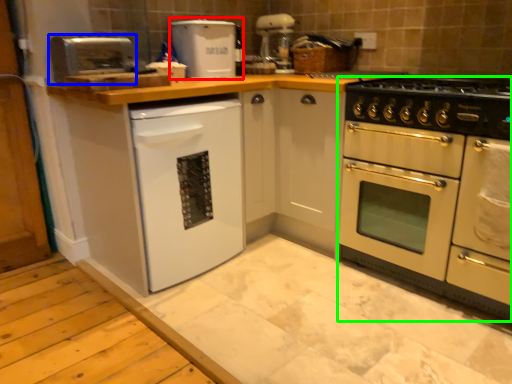
Question: Estimate the real-world distances between objects in this image. Which object is closer to appliance (highlighted by a red box), appliance (highlighted by a blue box) or oven (highlighted by a green box)?

Choices:
 (A) appliance
 (B) oven

Answer: (A)